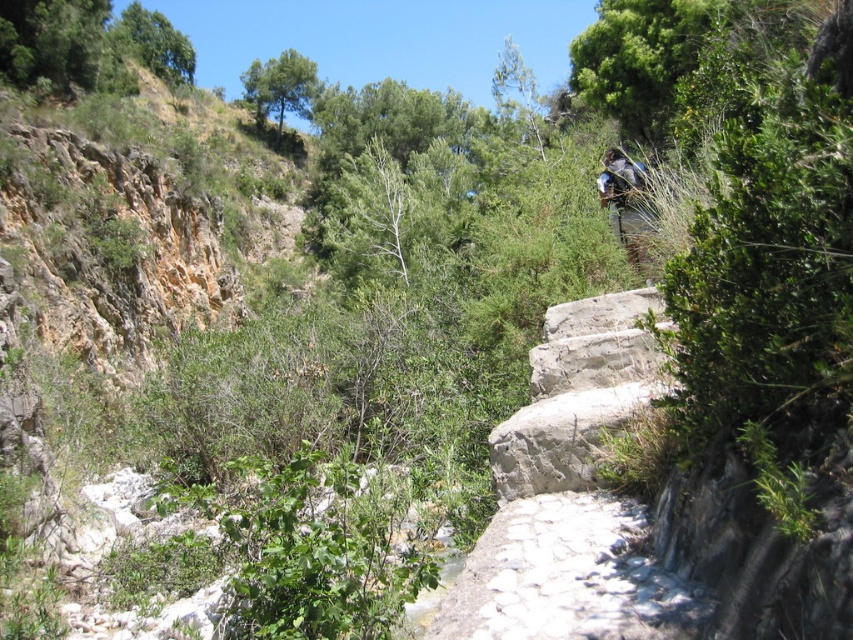
From the picture: Can you confirm if white stone path at center is thinner than blue fabric backpack at upper right?

Incorrect, white stone path at center's width is not less than blue fabric backpack at upper right's.

Who is taller, white stone path at center or blue fabric backpack at upper right?

Standing taller between the two is white stone path at center.

Does point (523, 509) come farther from viewer compared to point (631, 205)?

No, (523, 509) is in front of (631, 205).

The height and width of the screenshot is (640, 853). I want to click on white stone path at center, so click(566, 577).